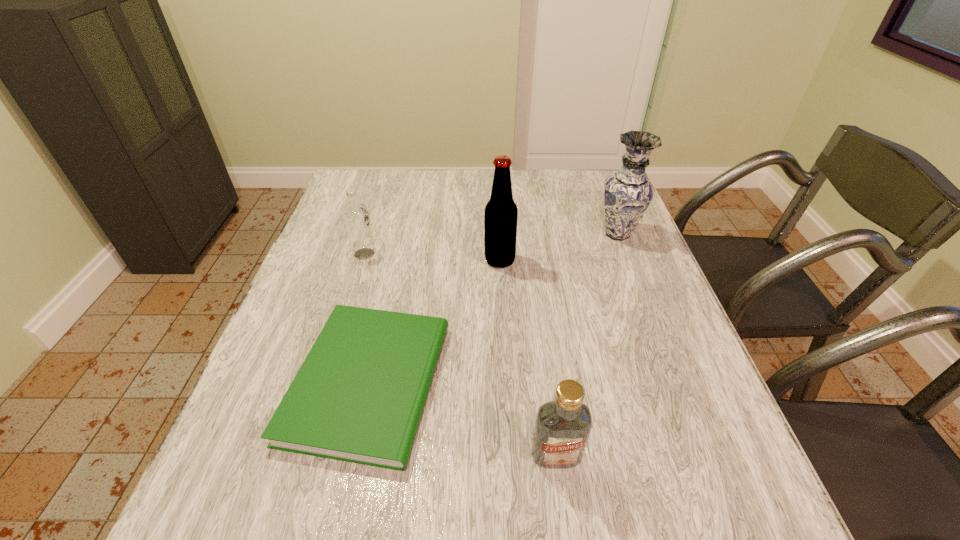
Identify the location of vacant space that's between the vase and the shortest object. 492,308.

Locate an element on the screen. Image resolution: width=960 pixels, height=540 pixels. free space between the paperback book and the right vodka is located at coordinates (463, 418).

Choose which object is the third nearest neighbor to the paperback book. Please provide its 2D coordinates. Your answer should be formatted as a tuple, i.e. [(x, y)], where the tuple contains the x and y coordinates of a point satisfying the conditions above.

[(356, 217)]

This screenshot has width=960, height=540. Identify the location of object that stands as the third closest to the vase. (562, 429).

The image size is (960, 540). In order to click on vacant space that satisfies the following two spatial constraints: 1. on the front label of the left vodka; 2. on the left side of the beer bottle in this screenshot , I will do `click(363, 260)`.

Locate an element on the screen. The height and width of the screenshot is (540, 960). vacant region that satisfies the following two spatial constraints: 1. on the front label of the left vodka; 2. on the back side of the beer bottle is located at coordinates (363, 260).

Identify the location of vacant area that satisfies the following two spatial constraints: 1. on the front label of the left vodka; 2. on the right side of the paperback book. (325, 382).

Locate an element on the screen. The width and height of the screenshot is (960, 540). free space that satisfies the following two spatial constraints: 1. on the back side of the beer bottle; 2. on the left side of the rightmost object is located at coordinates (498, 234).

Identify the location of free space that satisfies the following two spatial constraints: 1. on the front label of the left vodka; 2. on the left side of the beer bottle. 363,260.